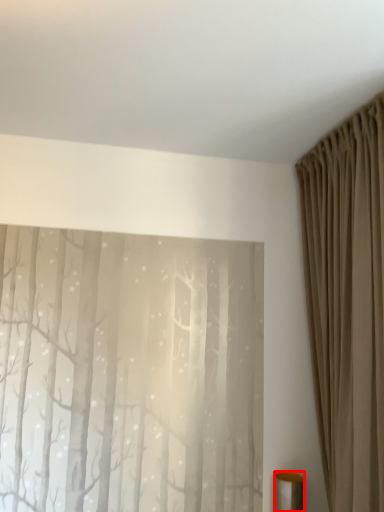
Question: Considering the relative positions of furniture (annotated by the red box) and curtain in the image provided, where is furniture (annotated by the red box) located with respect to the staircase?

Choices:
 (A) right
 (B) left

Answer: (B)